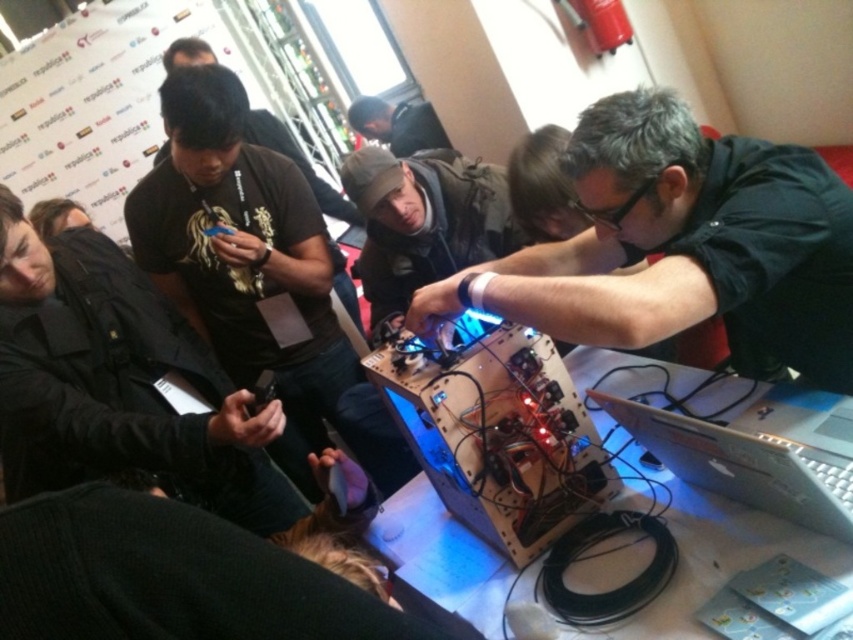
Question: Is matte black shirt at center wider than wooden circuit board at center?

Choices:
 (A) yes
 (B) no

Answer: (A)

Question: Among these points, which one is nearest to the camera?

Choices:
 (A) (378, 124)
 (B) (828, 202)
 (C) (96, 422)

Answer: (B)

Question: Is matte black shirt at center to the left of silver metallic laptop at lower right from the viewer's perspective?

Choices:
 (A) no
 (B) yes

Answer: (B)

Question: Which of these objects is positioned farthest from the silver metallic laptop at lower right?

Choices:
 (A) wooden circuit board at center
 (B) dark gray fabric jacket at center

Answer: (B)

Question: Among these points, which one is farthest from the camera?

Choices:
 (A) (531, 522)
 (B) (341, 330)

Answer: (B)

Question: Does matte black shirt at center appear under black matte t-shirt at center?

Choices:
 (A) yes
 (B) no

Answer: (B)